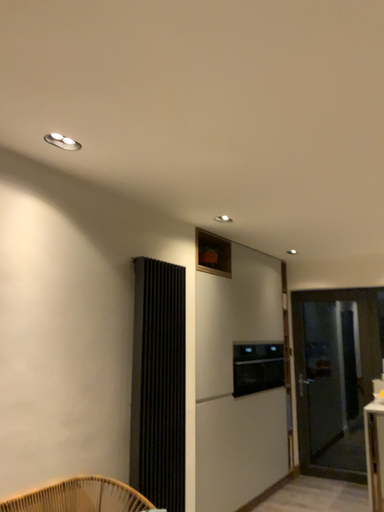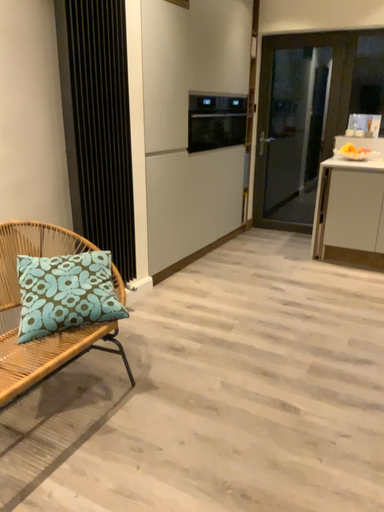
Question: How did the camera likely rotate when shooting the video?

Choices:
 (A) rotated upward
 (B) rotated downward

Answer: (B)